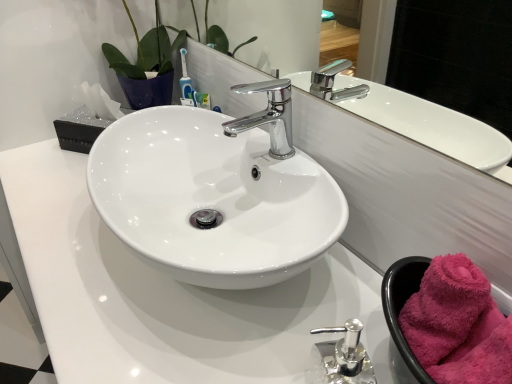
Question: Considering the positions of white glossy counter top at center and glossy ceramic mirror at upper center in the image, is white glossy counter top at center bigger or smaller than glossy ceramic mirror at upper center?

Choices:
 (A) big
 (B) small

Answer: (A)

Question: Considering the positions of white glossy counter top at center and glossy ceramic mirror at upper center in the image, is white glossy counter top at center wider or thinner than glossy ceramic mirror at upper center?

Choices:
 (A) thin
 (B) wide

Answer: (B)

Question: Estimate the real-world distances between objects in this image. Which object is farther from the pink fluffy bath towel at lower right?

Choices:
 (A) chrome/metallic faucet at center
 (B) white glossy counter top at center
 (C) glossy ceramic mirror at upper center

Answer: (C)

Question: Estimate the real-world distances between objects in this image. Which object is closer to the chrome/metallic faucet at center?

Choices:
 (A) pink fluffy bath towel at lower right
 (B) glossy ceramic mirror at upper center
 (C) white glossy counter top at center

Answer: (B)